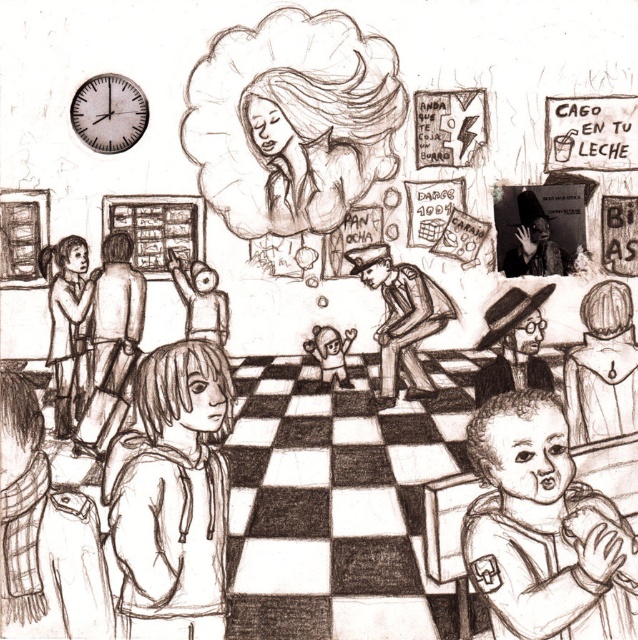
Question: Is smooth skin baby at lower right positioned behind smooth brown uniform at center?

Choices:
 (A) yes
 (B) no

Answer: (B)

Question: Is smooth brown uniform at center to the right of smooth skin child at left from the viewer's perspective?

Choices:
 (A) yes
 (B) no

Answer: (A)

Question: Estimate the real-world distances between objects in this image. Which object is farther from the smooth skin baby at lower right?

Choices:
 (A) smooth beige doll at center
 (B) smooth hoodie at center
 (C) smooth skin child at left

Answer: (C)

Question: Which of these objects is positioned farthest from the smooth skin baby at lower right?

Choices:
 (A) smooth beige doll at center
 (B) smooth skin child at left
 (C) smooth brown uniform at center
 (D) smooth hoodie at center

Answer: (B)

Question: Estimate the real-world distances between objects in this image. Which object is closer to the smooth beige doll at center?

Choices:
 (A) smooth brown uniform at center
 (B) smooth skin child at left
 (C) smooth hoodie at center
 (D) smooth skin baby at lower right

Answer: (A)

Question: Can you confirm if smooth hoodie at center is positioned above smooth brown uniform at center?

Choices:
 (A) yes
 (B) no

Answer: (B)